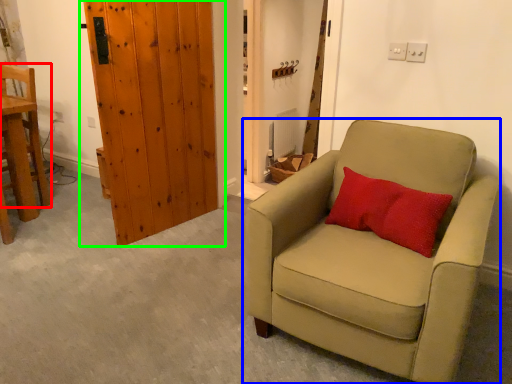
Question: Which object is positioned closest to chair (highlighted by a red box)? Select from chair (highlighted by a blue box) and door (highlighted by a green box).

Choices:
 (A) chair
 (B) door

Answer: (B)